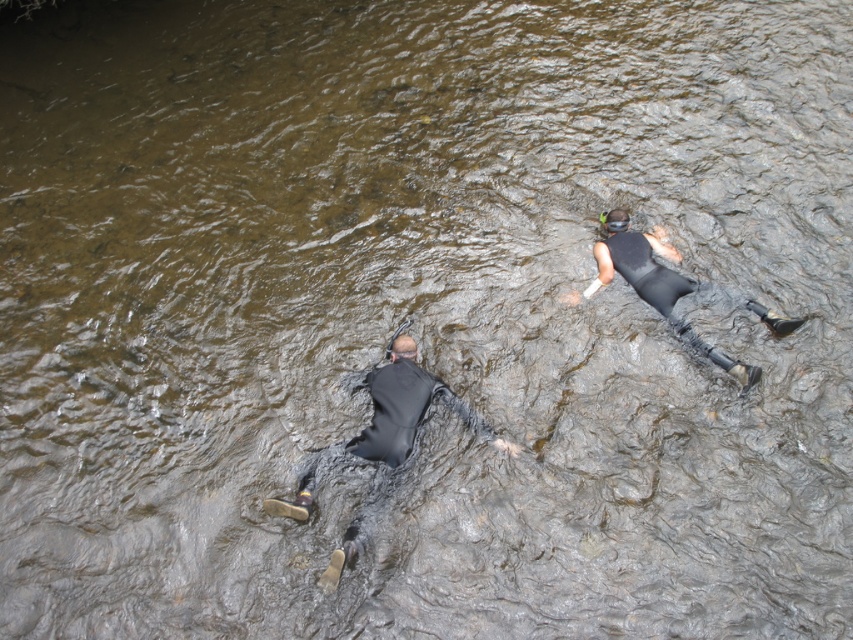
Question: Can you confirm if black matte wetsuit at lower left is bigger than black matte wetsuit at upper right?

Choices:
 (A) yes
 (B) no

Answer: (A)

Question: Can you confirm if black matte wetsuit at lower left is bigger than black matte wetsuit at upper right?

Choices:
 (A) yes
 (B) no

Answer: (A)

Question: Which of the following is the closest to the observer?

Choices:
 (A) (410, 376)
 (B) (616, 244)

Answer: (A)

Question: Which point is farther from the camera taking this photo?

Choices:
 (A) tap(462, 408)
 (B) tap(659, 252)

Answer: (B)

Question: Where is black matte wetsuit at lower left located in relation to black matte wetsuit at upper right in the image?

Choices:
 (A) below
 (B) above

Answer: (A)

Question: Among these points, which one is nearest to the camera?

Choices:
 (A) (735, 376)
 (B) (368, 440)

Answer: (B)